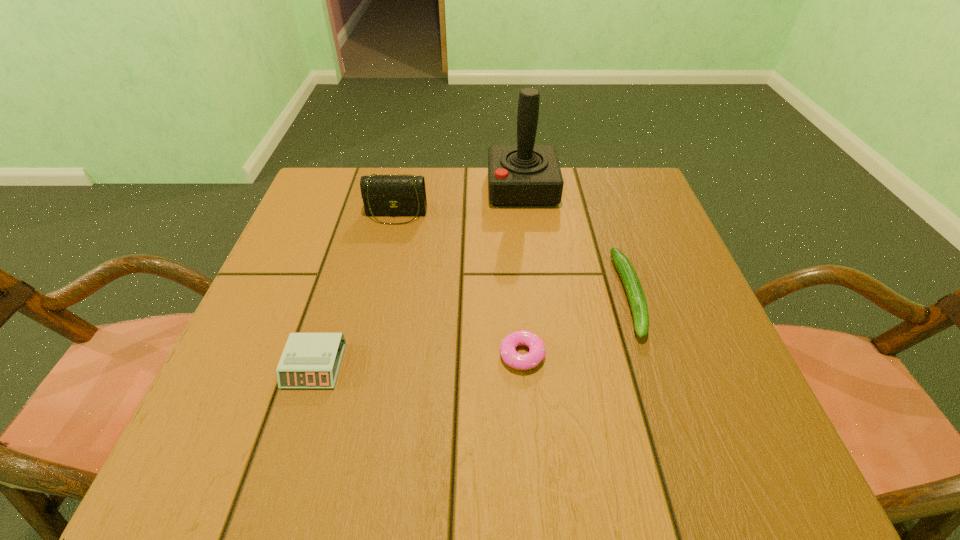
Locate an element on the screen. vacant space located 0.120m on the front-facing side of the rightmost object is located at coordinates (665, 404).

Identify the location of vacant space located 0.110m on the right of the doughnut. This screenshot has width=960, height=540. (x=607, y=355).

You are a GUI agent. You are given a task and a screenshot of the screen. Output one action in this format:
    pyautogui.click(x=<x>, y=<y>)
    Task: Click on the joystick positioned at the far edge
    
    Given the screenshot: What is the action you would take?
    pyautogui.click(x=524, y=175)

Locate an element on the screen. clutch bag located at the far edge is located at coordinates (384, 195).

Locate an element on the screen. The height and width of the screenshot is (540, 960). clutch bag located in the left edge section of the desktop is located at coordinates (384, 195).

I want to click on alarm clock positioned at the left edge, so click(309, 360).

Locate an element on the screen. The width and height of the screenshot is (960, 540). object located in the right edge section of the desktop is located at coordinates (632, 285).

At what (x,y) coordinates should I click in order to perform the action: click on object that is at the far left corner. Please return your answer as a coordinate pair (x, y). This screenshot has height=540, width=960. Looking at the image, I should click on (384, 195).

In the image, there is a desktop. Identify the location of vacant space at the near edge. (629, 434).

Where is `vacant space at the left edge`? The image size is (960, 540). vacant space at the left edge is located at coordinates pyautogui.click(x=333, y=285).